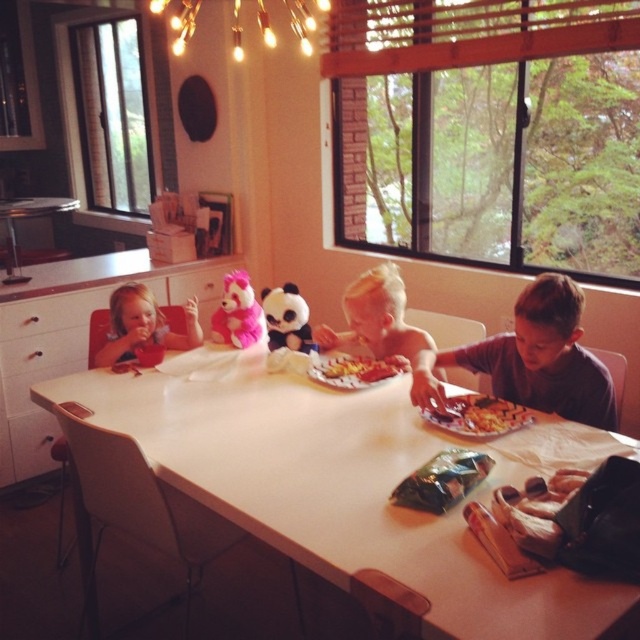
You are a parent setting up a birthday party for your child. You want to ensure the matte plush panda at center is visible under the warm matte string lights at upper center. Is the current setup allowing the panda to be illuminated by the lights?

The warm matte string lights at upper center are positioned over the matte plush panda at center, so yes, the panda is illuminated by the lights.

You are a child who wants to grab the golden crispy fries at center and the yellow paper plate at center. If your hand can reach 14 inches, can you reach both items without moving your hand?

The golden crispy fries at center and the yellow paper plate at center are 14.75 inches apart. Since your hand can only reach 14 inches, you cannot reach both items without moving your hand.